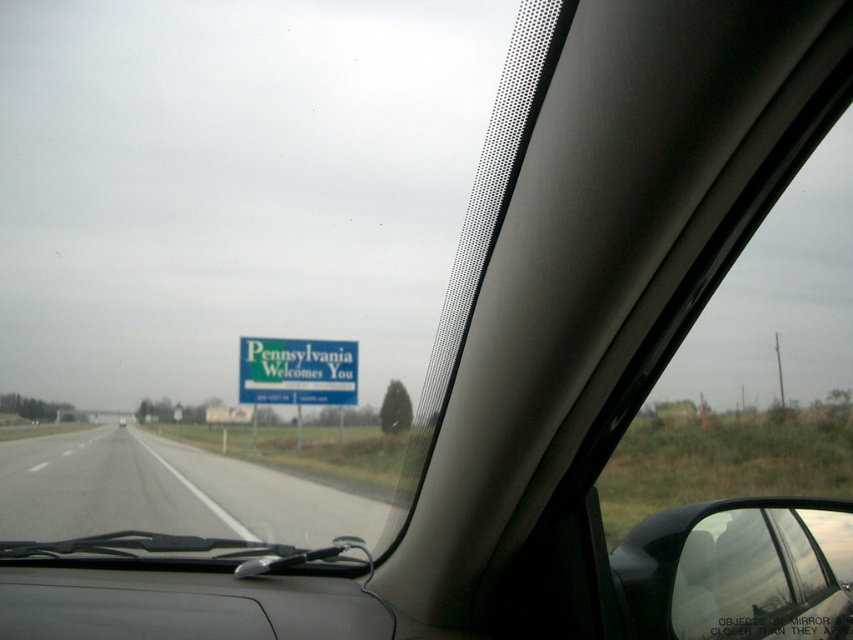
You are driving and see the gray asphalt highway at center and the green matte signboard at center outside your window. Which object is positioned to the left side from your perspective?

The gray asphalt highway at center is to the left of the green matte signboard at center.

You are a driver approaching the Pennsylvania border. You notice the gray asphalt highway at center and the green matte signboard at center outside your window. Which object appears taller in the view from your current position?

The gray asphalt highway at center appears taller than the green matte signboard at center in the view from your current position.

You are a passenger in a car driving on the highway. You look out the window and see the gray asphalt highway at center and the green matte signboard at center. Which object is closer to the bottom of the window?

The gray asphalt highway at center is closer to the bottom of the window because it is positioned below the green matte signboard at center.